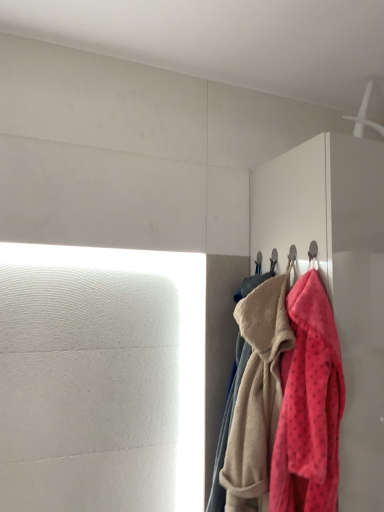
What do you see at coordinates (257, 396) in the screenshot? This screenshot has height=512, width=384. I see `fluffy pink towel at right, placed as the second towel when sorted from front to back` at bounding box center [257, 396].

Where is `fluffy pink towel at right, placed as the 2th towel when sorted from back to front`? fluffy pink towel at right, placed as the 2th towel when sorted from back to front is located at coordinates (309, 405).

Considering the relative sizes of fluffy pink towel at right, acting as the 1th towel starting from the front, and matte white dresser at right in the image provided, is fluffy pink towel at right, acting as the 1th towel starting from the front, bigger than matte white dresser at right?

No.

Looking at this image, is fluffy pink towel at right, acting as the 1th towel starting from the front, situated inside matte white dresser at right or outside?

fluffy pink towel at right, acting as the 1th towel starting from the front, exists outside the volume of matte white dresser at right.

Is matte white dresser at right at the back of fluffy pink towel at right, placed as the 2th towel when sorted from back to front?

Correct, fluffy pink towel at right, placed as the 2th towel when sorted from back to front, is looking away from matte white dresser at right.

Is matte white dresser at right turned away from fluffy pink towel at right, placed as the second towel when sorted from front to back?

No, matte white dresser at right's orientation is not away from fluffy pink towel at right, placed as the second towel when sorted from front to back.

What are the coordinates of `dresser that appears on the right of fluffy pink towel at right, marked as the first towel in a back-to-front arrangement` in the screenshot? It's located at [x=337, y=278].

Is matte white dresser at right in front of or behind fluffy pink towel at right, marked as the first towel in a back-to-front arrangement, in the image?

Visually, matte white dresser at right is located in front of fluffy pink towel at right, marked as the first towel in a back-to-front arrangement.

Does point (326, 406) appear closer or farther from the camera than point (243, 400)?

Point (326, 406) is positioned closer to the camera compared to point (243, 400).

Image resolution: width=384 pixels, height=512 pixels. I want to click on towel in front of the fluffy pink towel at right, marked as the first towel in a back-to-front arrangement, so click(x=309, y=405).

From the picture: Which object is wider, fluffy pink towel at right, placed as the 2th towel when sorted from back to front, or fluffy pink towel at right, marked as the first towel in a back-to-front arrangement?

With larger width is fluffy pink towel at right, marked as the first towel in a back-to-front arrangement.

From the image's perspective, which one is positioned lower, fluffy pink towel at right, placed as the 2th towel when sorted from back to front, or fluffy pink towel at right, marked as the first towel in a back-to-front arrangement?

fluffy pink towel at right, marked as the first towel in a back-to-front arrangement.

Does fluffy pink towel at right, marked as the first towel in a back-to-front arrangement, lie in front of fluffy pink towel at right, placed as the 2th towel when sorted from back to front?

That is False.

Is fluffy pink towel at right, placed as the second towel when sorted from front to back, aimed at fluffy pink towel at right, acting as the 1th towel starting from the front?

No, fluffy pink towel at right, placed as the second towel when sorted from front to back, is not facing towards fluffy pink towel at right, acting as the 1th towel starting from the front.

Identify the location of towel lying on the right of fluffy pink towel at right, placed as the second towel when sorted from front to back. (309, 405).

Between point (279, 343) and point (327, 433), which one is positioned in front?

The point (327, 433) is in front.

Considering the relative sizes of fluffy pink towel at right, placed as the second towel when sorted from front to back, and matte white dresser at right in the image provided, is fluffy pink towel at right, placed as the second towel when sorted from front to back, bigger than matte white dresser at right?

Incorrect, fluffy pink towel at right, placed as the second towel when sorted from front to back, is not larger than matte white dresser at right.

Is fluffy pink towel at right, marked as the first towel in a back-to-front arrangement, at the right side of matte white dresser at right?

In fact, fluffy pink towel at right, marked as the first towel in a back-to-front arrangement, is to the left of matte white dresser at right.

Is fluffy pink towel at right, placed as the second towel when sorted from front to back, facing towards matte white dresser at right?

No, fluffy pink towel at right, placed as the second towel when sorted from front to back, does not turn towards matte white dresser at right.

Is matte white dresser at right not close to fluffy pink towel at right, placed as the 2th towel when sorted from back to front?

No, matte white dresser at right is not far from fluffy pink towel at right, placed as the 2th towel when sorted from back to front.

Looking at their sizes, would you say matte white dresser at right is wider or thinner than fluffy pink towel at right, placed as the 2th towel when sorted from back to front?

matte white dresser at right is wider than fluffy pink towel at right, placed as the 2th towel when sorted from back to front.

Does matte white dresser at right come behind fluffy pink towel at right, placed as the 2th towel when sorted from back to front?

Yes.

From the image's perspective, does matte white dresser at right appear higher than fluffy pink towel at right, placed as the 2th towel when sorted from back to front?

Yes.

Where is `dresser located behind the fluffy pink towel at right, placed as the 2th towel when sorted from back to front`? The width and height of the screenshot is (384, 512). dresser located behind the fluffy pink towel at right, placed as the 2th towel when sorted from back to front is located at coordinates (337, 278).

I want to click on dresser in front of the fluffy pink towel at right, placed as the second towel when sorted from front to back, so click(x=337, y=278).

Looking at the image, which one is located closer to matte white dresser at right, fluffy pink towel at right, marked as the first towel in a back-to-front arrangement, or fluffy pink towel at right, placed as the 2th towel when sorted from back to front?

fluffy pink towel at right, placed as the 2th towel when sorted from back to front, is closer to matte white dresser at right.

Estimate the real-world distances between objects in this image. Which object is closer to fluffy pink towel at right, acting as the 1th towel starting from the front, matte white dresser at right or fluffy pink towel at right, placed as the second towel when sorted from front to back?

fluffy pink towel at right, placed as the second towel when sorted from front to back, is closer to fluffy pink towel at right, acting as the 1th towel starting from the front.

From the image, which object appears to be farther from fluffy pink towel at right, marked as the first towel in a back-to-front arrangement, matte white dresser at right or fluffy pink towel at right, placed as the 2th towel when sorted from back to front?

matte white dresser at right lies further to fluffy pink towel at right, marked as the first towel in a back-to-front arrangement, than the other object.

Consider the image. Considering their positions, is fluffy pink towel at right, placed as the second towel when sorted from front to back, positioned further to fluffy pink towel at right, acting as the 1th towel starting from the front, than matte white dresser at right?

matte white dresser at right.

When comparing their distances from matte white dresser at right, does fluffy pink towel at right, acting as the 1th towel starting from the front, or fluffy pink towel at right, marked as the first towel in a back-to-front arrangement, seem further?

Based on the image, fluffy pink towel at right, marked as the first towel in a back-to-front arrangement, appears to be further to matte white dresser at right.

From the picture: Based on their spatial positions, is fluffy pink towel at right, acting as the 1th towel starting from the front, or matte white dresser at right closer to fluffy pink towel at right, marked as the first towel in a back-to-front arrangement?

fluffy pink towel at right, acting as the 1th towel starting from the front.

Locate an element on the screen. This screenshot has height=512, width=384. towel located between fluffy pink towel at right, placed as the second towel when sorted from front to back, and matte white dresser at right in the left-right direction is located at coordinates (309, 405).